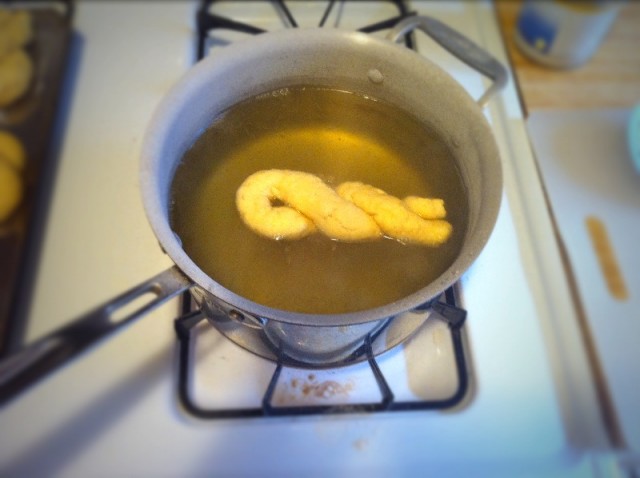
Where is `baking sheet`? baking sheet is located at coordinates point(40,115).